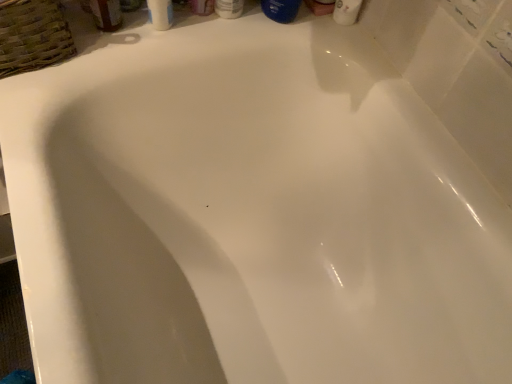
Where is `spots to the right of woven brown basket at upper left`? spots to the right of woven brown basket at upper left is located at coordinates (116, 46).